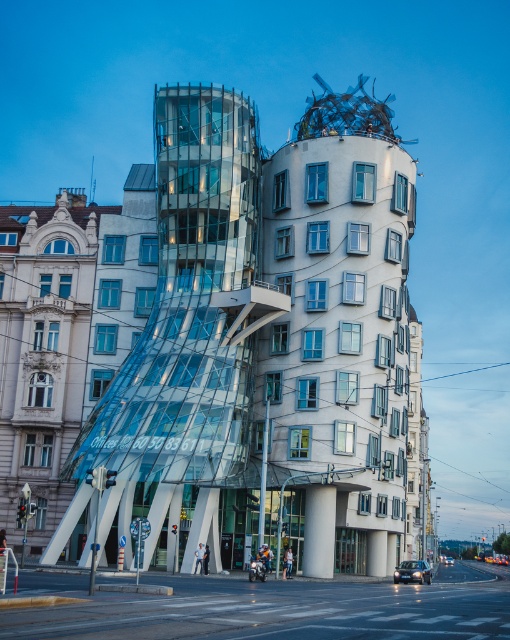
Consider the image. Does transparent glass building at center appear on the right side of white smooth pillar at center?

Correct, you'll find transparent glass building at center to the right of white smooth pillar at center.

Does transparent glass building at center have a larger size compared to white smooth pillar at center?

Correct, transparent glass building at center is larger in size than white smooth pillar at center.

Between point (160, 433) and point (330, 538), which one is positioned behind?

Point (330, 538)

You are a GUI agent. You are given a task and a screenshot of the screen. Output one action in this format:
    pyautogui.click(x=<x>, y=<y>)
    Task: Click on the transparent glass building at center
    The image size is (510, 640).
    Given the screenshot: What is the action you would take?
    pyautogui.click(x=270, y=339)